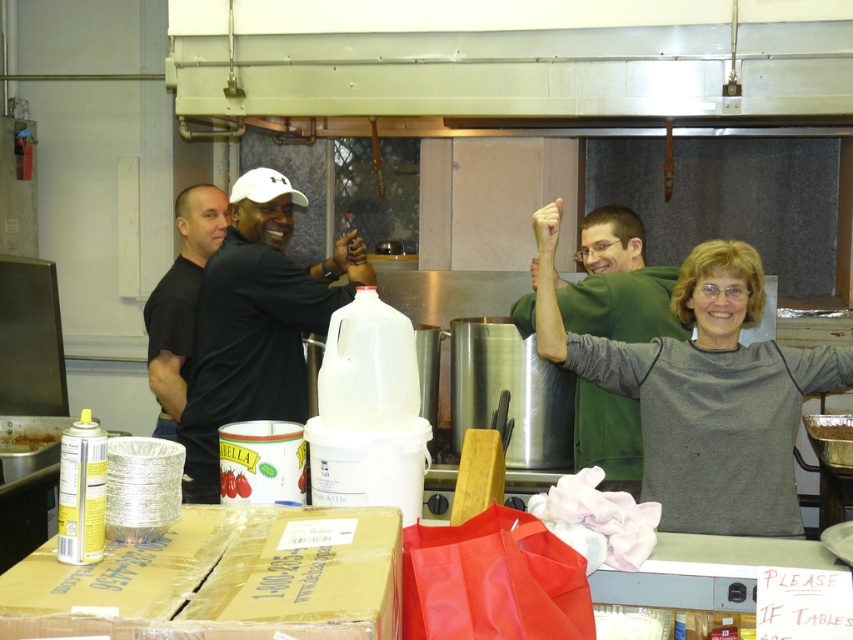
You are organizing a clothing donation drive and need to determine which items can fit into a small donation bin. Given the gray matte sweater at center and the green matte shirt at center, which one is more likely to fit in the bin?

The gray matte sweater at center occupies less space than the green matte shirt at center, so it is more likely to fit in the small donation bin.

You are standing at point A located at coordinates point A at (653, 268). You need to reach point B located at coordinates point B at 0.680, 0.954. The distance between them is 3.02 meters. If you have a 2.5 meter long rope, can you safely cross the gap between point A and point B?

The distance between point A at (653, 268) and point B at 0.680, 0.954 is 3.02 meters. Since the rope is only 2.5 meters long, it is shorter than the required distance. Therefore, you cannot safely cross the gap using the rope.

You are a chef in a busy kitchen and you need to reach the red shopping bag near the center. There is a green matte shirt at center and a smooth skin hand at upper right in your way. Which object should you move first to access the red shopping bag?

The green matte shirt at center is in front of smooth skin hand at upper right, so you should move the green matte shirt at center first to access the red shopping bag.